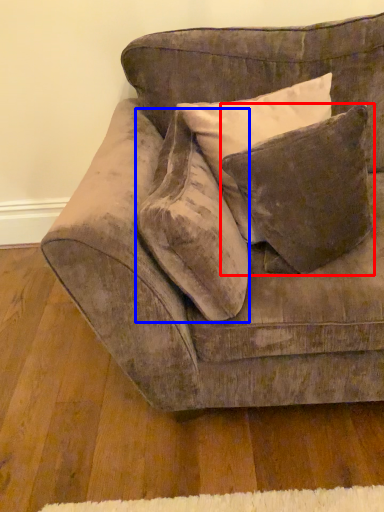
Question: Among these objects, which one is farthest to the camera, pillow (highlighted by a red box) or throw pillow (highlighted by a blue box)?

Choices:
 (A) pillow
 (B) throw pillow

Answer: (A)